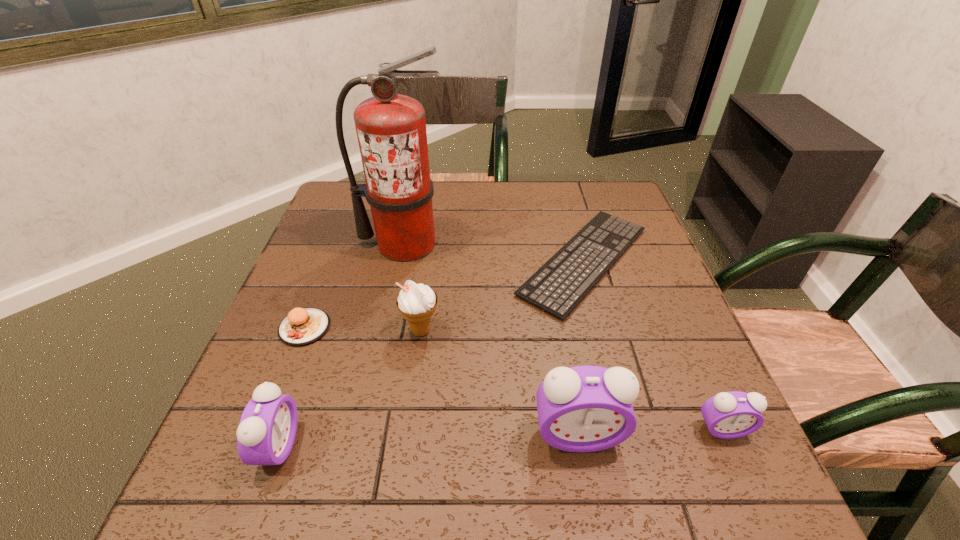
Locate which alarm clock is the third closest to the sixth tallest object. Please provide its 2D coordinates. Your answer should be formatted as a tuple, i.e. [(x, y)], where the tuple contains the x and y coordinates of a point satisfying the conditions above.

[(728, 415)]

The image size is (960, 540). I want to click on free space that satisfies the following two spatial constraints: 1. toward the nozzle of the tallest object; 2. on the face of the fourth shortest object, so click(x=363, y=446).

I want to click on free spot that satisfies the following two spatial constraints: 1. toward the nozzle of the icecream; 2. on the right side of the fire extinguisher, so click(x=387, y=330).

The width and height of the screenshot is (960, 540). I want to click on vacant space that satisfies the following two spatial constraints: 1. toward the nozzle of the tallest object; 2. on the face of the fourth tallest object, so coord(363,446).

The width and height of the screenshot is (960, 540). Find the location of `vacant region that satisfies the following two spatial constraints: 1. on the face of the fifth tallest object; 2. on the face of the leftmost alarm clock`. vacant region that satisfies the following two spatial constraints: 1. on the face of the fifth tallest object; 2. on the face of the leftmost alarm clock is located at coordinates coord(730,446).